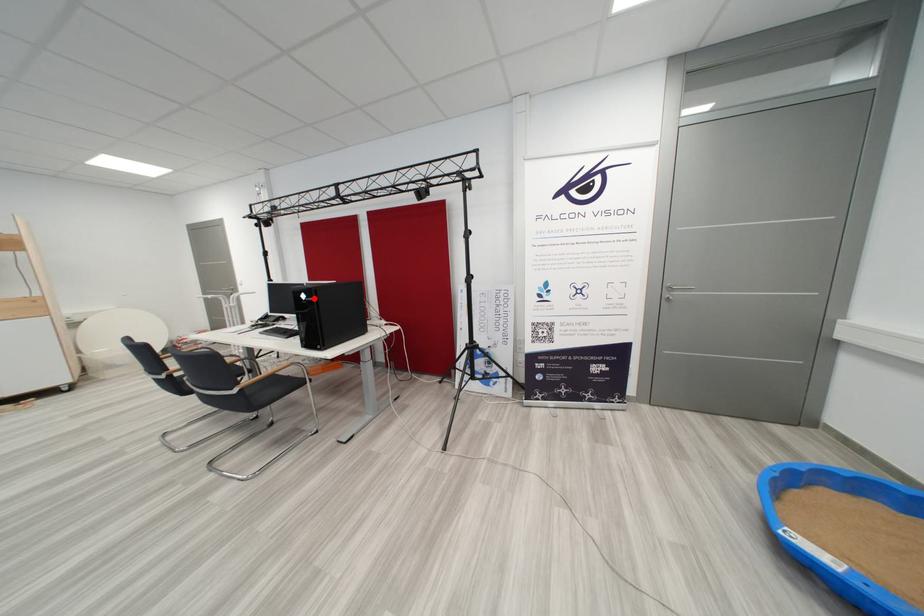
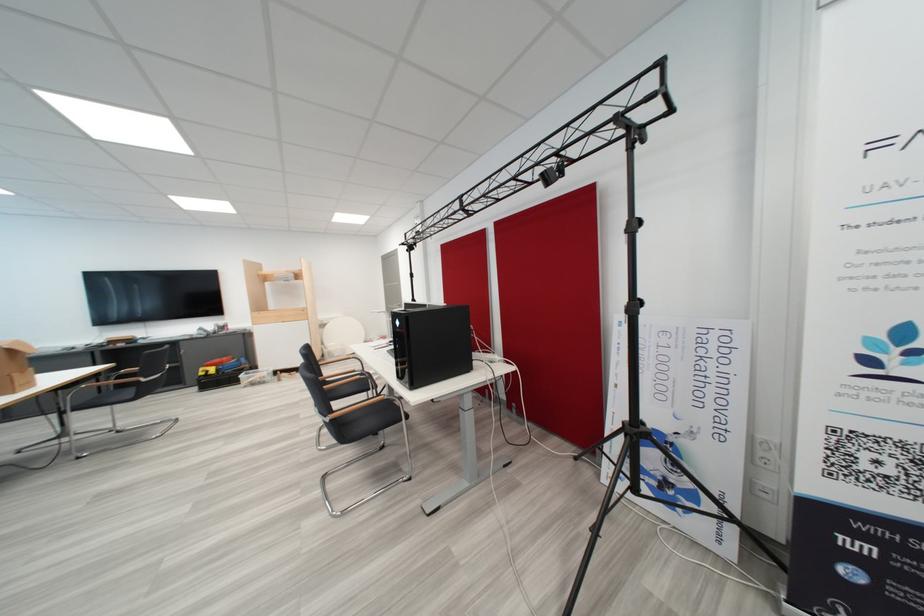
Question: A red point is marked in image1. In image2, is the corresponding 3D point closer to the camera or farther? Reply with the corresponding letter.

Choices:
 (A) The corresponding 3D point is closer.
 (B) The corresponding 3D point is farther.

Answer: (B)